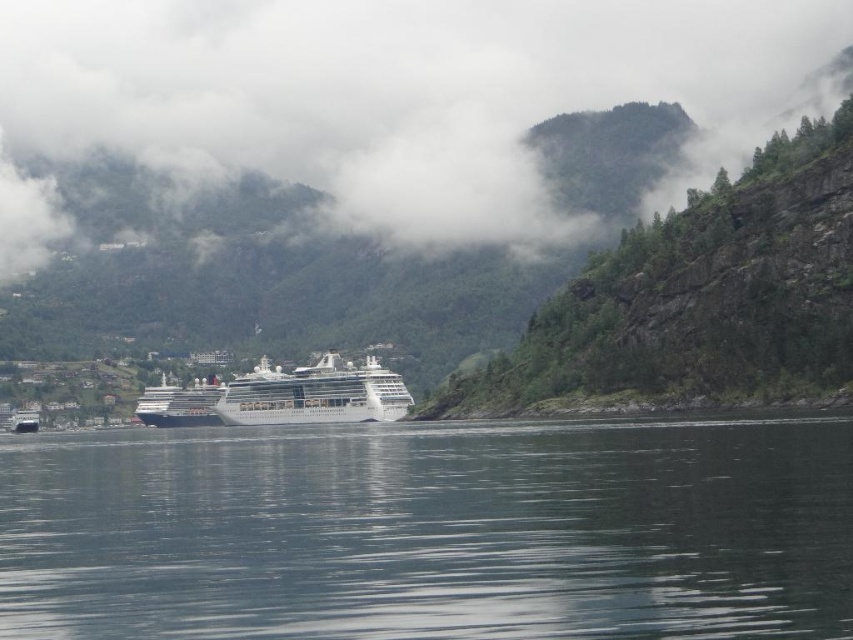
You are a photographer planning to capture the fjord landscape. You notice the white fluffy cloud at upper center and the green rocky hillside at upper center. Which object occupies a larger area in the frame?

The white fluffy cloud at upper center might be wider than the green rocky hillside at upper center, so it likely occupies a larger area in the frame.